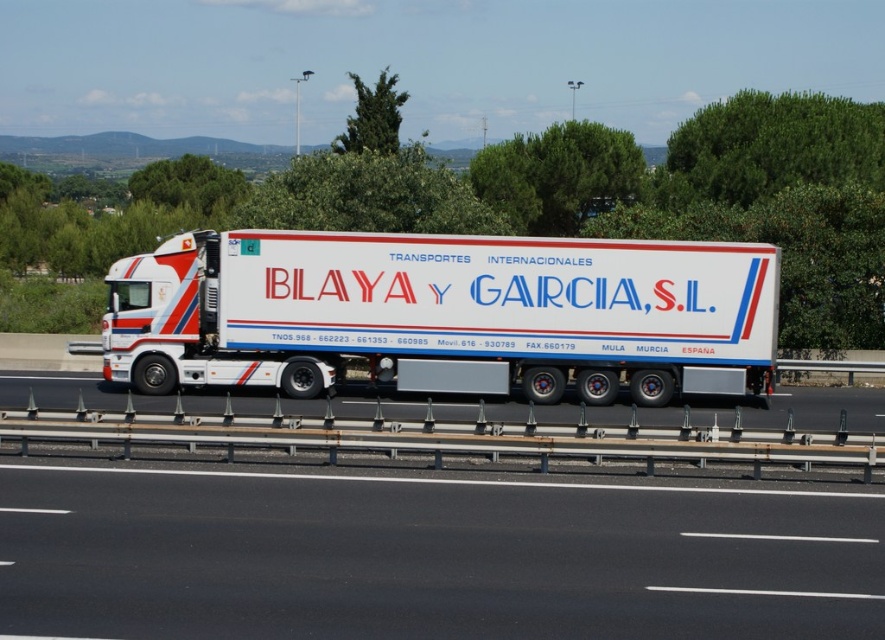
Is black asphalt road at center positioned behind white glossy trailer at center?

No, black asphalt road at center is closer to the viewer.

Which is behind, point (142, 554) or point (587, 256)?

Point (587, 256)

Is point (559, 502) in front of point (699, 243)?

Yes, point (559, 502) is closer to viewer.

This screenshot has height=640, width=885. Identify the location of black asphalt road at center. (428, 557).